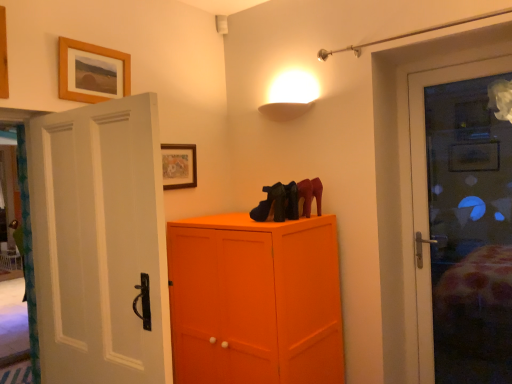
Question: Can you confirm if wooden picture frame at upper center, marked as the first picture frame in a top-to-bottom arrangement, is thinner than matte black shoes at center?

Choices:
 (A) yes
 (B) no

Answer: (A)

Question: From the image's perspective, is wooden picture frame at upper center, the 2th picture frame from the right, beneath matte black shoes at center?

Choices:
 (A) no
 (B) yes

Answer: (A)

Question: Can you confirm if wooden picture frame at upper center, marked as the first picture frame in a top-to-bottom arrangement, is positioned to the left of matte black shoes at center?

Choices:
 (A) yes
 (B) no

Answer: (A)

Question: Does wooden picture frame at upper center, the 2th picture frame from the right, have a larger size compared to matte black shoes at center?

Choices:
 (A) yes
 (B) no

Answer: (A)

Question: Does wooden picture frame at upper center, marked as the first picture frame in a top-to-bottom arrangement, have a smaller size compared to matte black shoes at center?

Choices:
 (A) no
 (B) yes

Answer: (A)

Question: Is matte black shoes at center completely or partially inside wooden picture frame at upper center, acting as the 1th picture frame starting from the left?

Choices:
 (A) yes
 (B) no

Answer: (B)

Question: From a real-world perspective, is matte wooden picture frame at upper center, which is the first picture frame from right to left, located higher than wooden picture frame at upper center, acting as the 1th picture frame starting from the left?

Choices:
 (A) yes
 (B) no

Answer: (B)

Question: Is matte wooden picture frame at upper center, placed as the 2th picture frame when sorted from front to back, positioned far away from wooden picture frame at upper center, which is counted as the first picture frame, starting from the front?

Choices:
 (A) yes
 (B) no

Answer: (B)

Question: Are matte wooden picture frame at upper center, acting as the 2th picture frame starting from the left, and wooden picture frame at upper center, placed as the 2th picture frame when sorted from back to front, beside each other?

Choices:
 (A) no
 (B) yes

Answer: (A)

Question: Does matte wooden picture frame at upper center, placed as the 1th picture frame when sorted from bottom to top, appear on the right side of wooden picture frame at upper center, marked as the first picture frame in a top-to-bottom arrangement?

Choices:
 (A) no
 (B) yes

Answer: (B)

Question: From the image's perspective, does matte wooden picture frame at upper center, marked as the 2th picture frame in a top-to-bottom arrangement, appear higher than wooden picture frame at upper center, placed as the second picture frame when sorted from bottom to top?

Choices:
 (A) no
 (B) yes

Answer: (A)

Question: Does matte wooden picture frame at upper center, which is the first picture frame in back-to-front order, have a greater height compared to wooden picture frame at upper center, the 2th picture frame from the right?

Choices:
 (A) no
 (B) yes

Answer: (A)

Question: Does matte black shoes at center appear on the left side of matte wooden picture frame at upper center, marked as the 2th picture frame in a top-to-bottom arrangement?

Choices:
 (A) yes
 (B) no

Answer: (B)